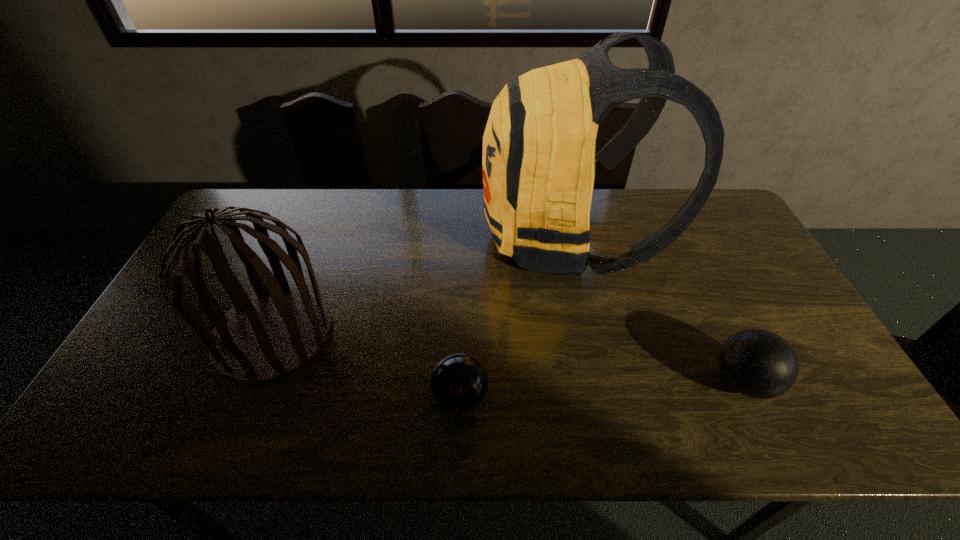
Where is `vacant space located on the back of the birdcage`? The width and height of the screenshot is (960, 540). vacant space located on the back of the birdcage is located at coordinates (320, 218).

Identify the location of vacant region located on the grip area of the right bowling ball. (550, 382).

Where is `vacant region located 0.240m on the grip area of the right bowling ball`? The height and width of the screenshot is (540, 960). vacant region located 0.240m on the grip area of the right bowling ball is located at coordinates (612, 382).

Image resolution: width=960 pixels, height=540 pixels. I want to click on free space located 0.320m on the grip area of the right bowling ball, so click(x=579, y=382).

The image size is (960, 540). What are the coordinates of `object at the far edge` in the screenshot? It's located at (538, 164).

At what (x,y) coordinates should I click in order to perform the action: click on object located in the right edge section of the desktop. Please return your answer as a coordinate pair (x, y). Looking at the image, I should click on (757, 363).

Find the location of a particular element. This screenshot has height=540, width=960. object that is at the near right corner is located at coordinates (757, 363).

At what (x,y) coordinates should I click in order to perform the action: click on blank area at the far edge. Please return your answer as a coordinate pair (x, y). The width and height of the screenshot is (960, 540). Looking at the image, I should click on (489, 231).

In the image, there is a desktop. Where is `free space at the near edge`? free space at the near edge is located at coordinates (550, 437).

The image size is (960, 540). In order to click on vacant region at the left edge of the desktop in this screenshot , I will do [x=210, y=260].